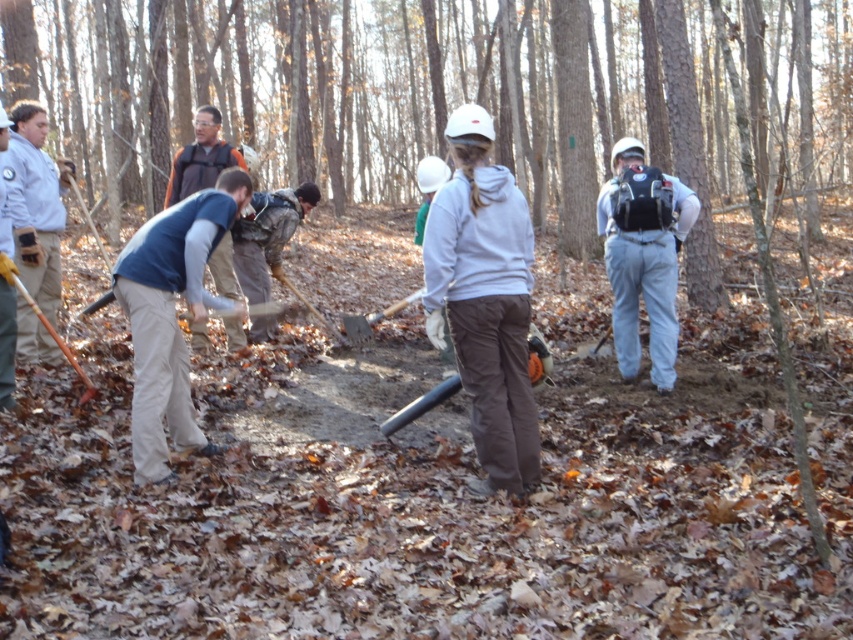
Question: Does light blue jeans at center appear on the right side of wooden shovel at left?

Choices:
 (A) no
 (B) yes

Answer: (B)

Question: Is white matte hoodie at center closer to camera compared to wooden shovel at left?

Choices:
 (A) no
 (B) yes

Answer: (B)

Question: Among these objects, which one is farthest from the camera?

Choices:
 (A) light gray shirt at left
 (B) white matte hoodie at center
 (C) light blue jeans at center
 (D) wooden handle shovel at center

Answer: (D)

Question: Estimate the real-world distances between objects in this image. Which object is farther from the wooden shovel at left?

Choices:
 (A) light gray shirt at left
 (B) white matte hoodie at center
 (C) blue fabric shirt at left
 (D) wooden handle shovel at center

Answer: (D)

Question: Which object is the farthest from the wooden handle shovel at center?

Choices:
 (A) blue fabric shirt at left
 (B) wooden shovel at left
 (C) light blue jeans at center
 (D) white matte hoodie at center

Answer: (D)

Question: Can you confirm if white matte hoodie at center is bigger than light gray shirt at left?

Choices:
 (A) yes
 (B) no

Answer: (B)